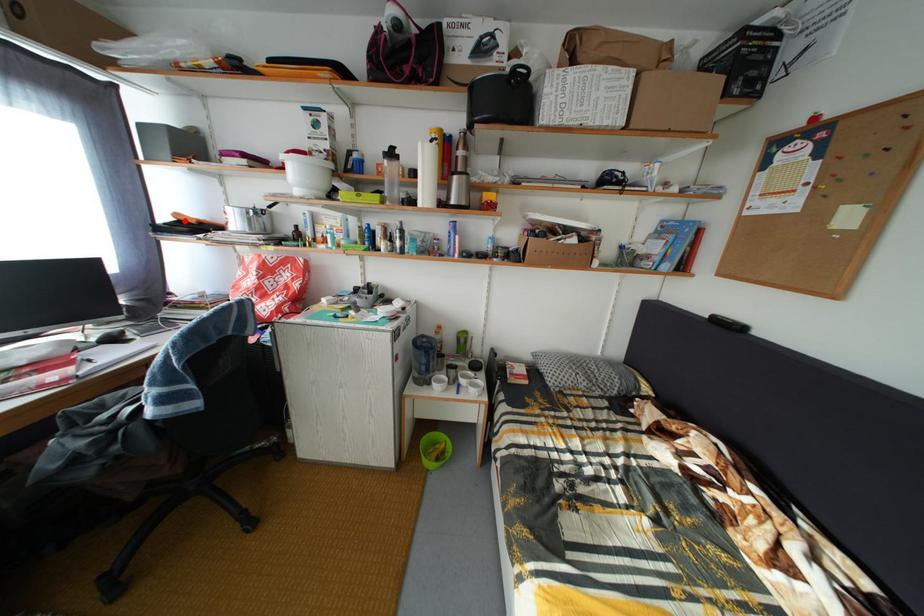
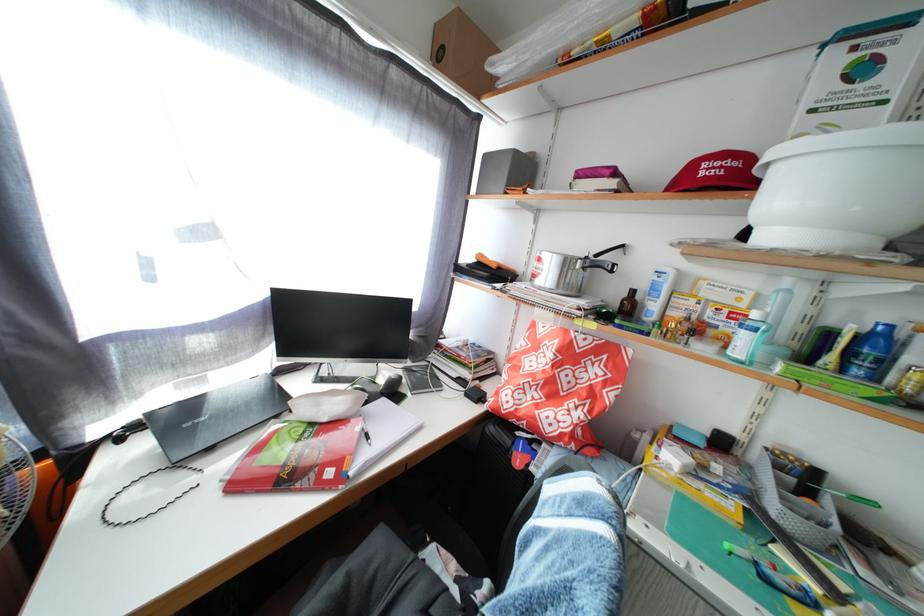
In the second image, find the point that corresponds to the highlighted location in the first image.

(489, 262)